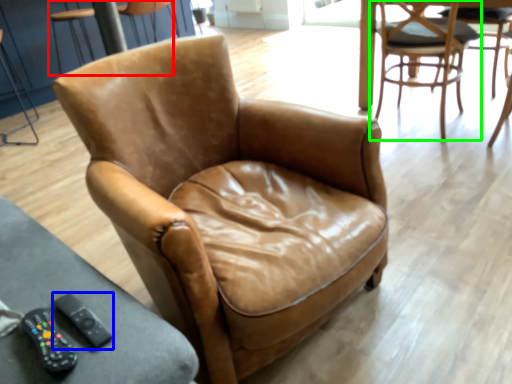
Question: Which object is positioned closest to chair (highlighted by a red box)? Select from remote (highlighted by a blue box) and chair (highlighted by a green box).

Choices:
 (A) remote
 (B) chair

Answer: (B)